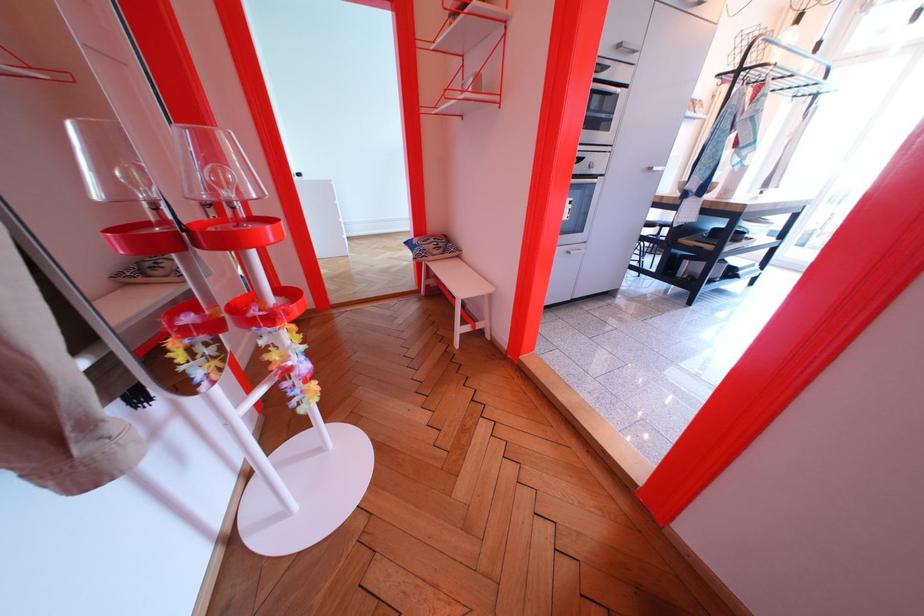
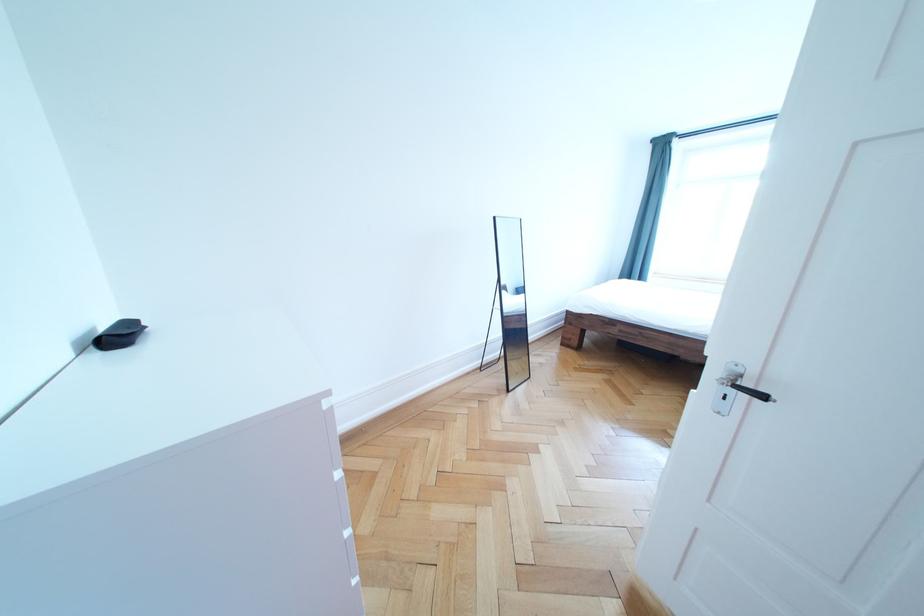
The point at [310,180] is marked in the first image. Where is the corresponding point in the second image?

(128, 344)